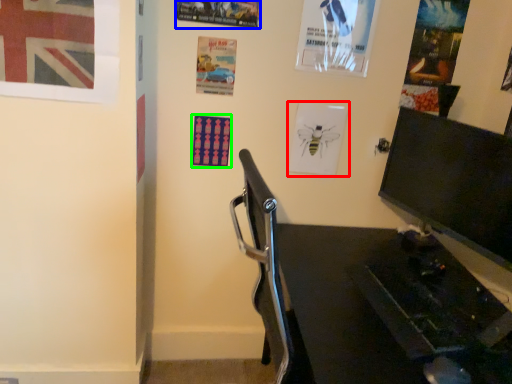
Question: Which is farther away from poster page (highlighted by a red box)? poster page (highlighted by a blue box) or poster page (highlighted by a green box)?

Choices:
 (A) poster page
 (B) poster page

Answer: (A)